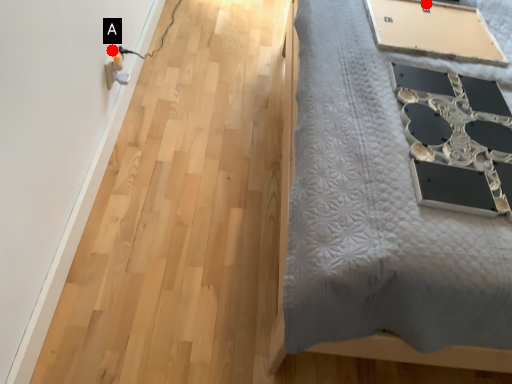
Question: Two points are circled on the image, labeled by A and B beside each circle. Among these points, which one is farthest from the camera?

Choices:
 (A) A is further
 (B) B is further

Answer: (A)